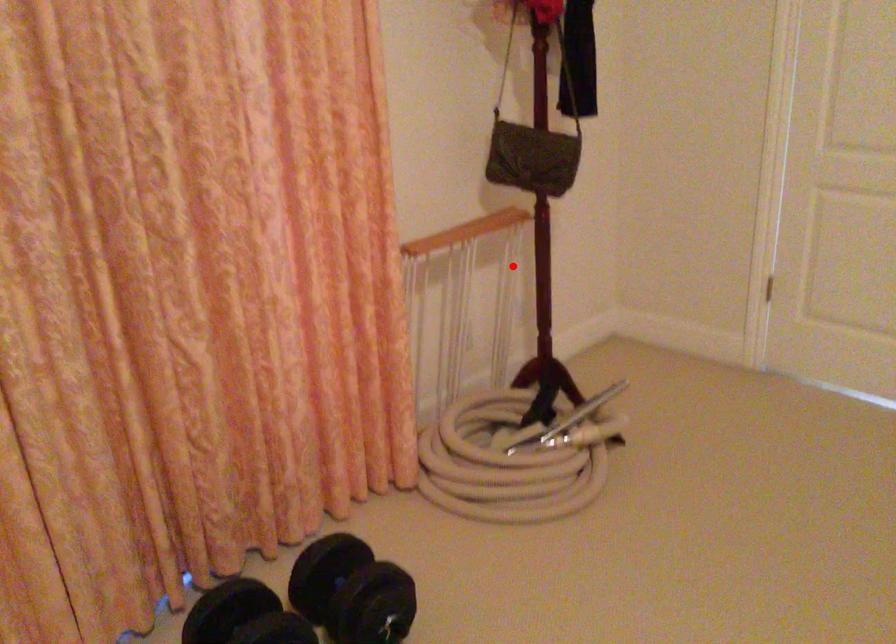
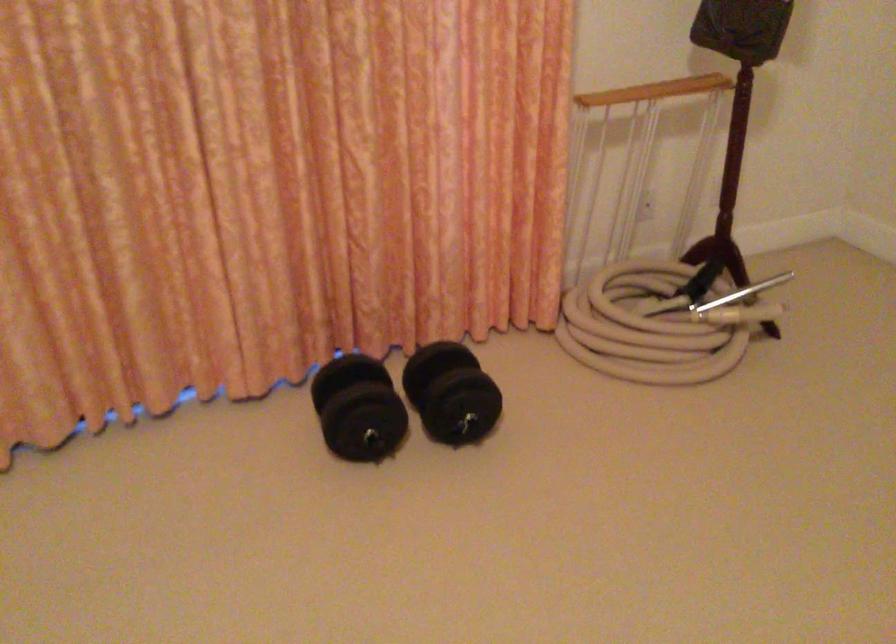
In the second image, find the point that corresponds to the highlighted location in the first image.

(719, 137)